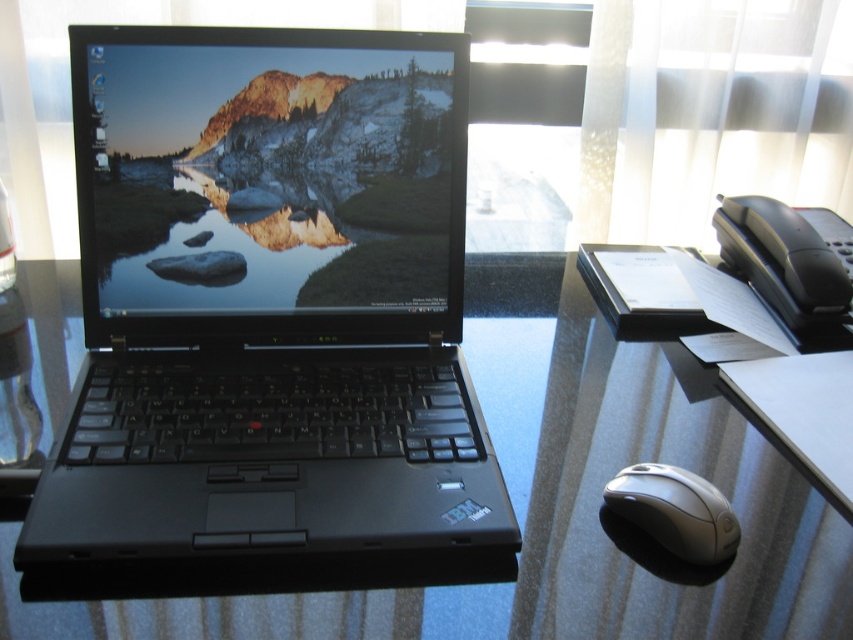
You are standing in front of the desk and want to locate the white sheer curtain at upper right. Based on the coordinates provided, where would you look relative to the desk?

The white sheer curtain at upper right is located at coordinates point (708, 113), which is at the upper right corner of the desk area.

You are standing in front of the workspace and want to reach the white sheer curtain at upper right. Considering your arm can extend 1 meter, can you touch it without moving your feet?

The white sheer curtain at upper right is 1.19 meters from the viewer. Since your arm can only extend 1 meter, you cannot touch it without moving your feet.

You are standing in front of the workspace and see the point at coordinates (708, 113). What object is located at this point?

The point at coordinates (708, 113) is located on the white sheer curtain at upper right.